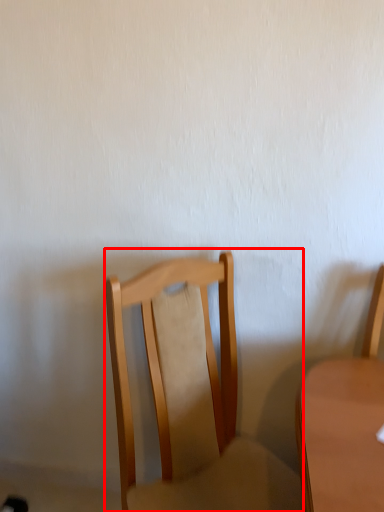
Question: In this image, where is chair (annotated by the red box) located relative to chair?

Choices:
 (A) left
 (B) right

Answer: (A)